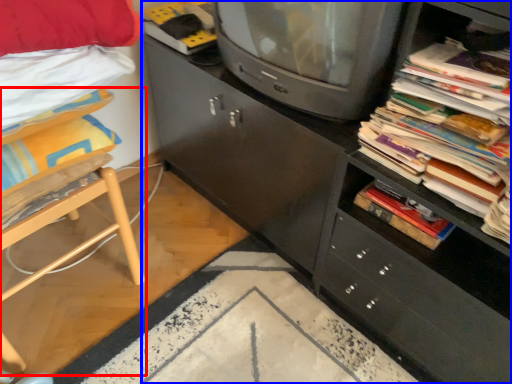
Question: Which object appears farthest to the camera in this image, furniture (highlighted by a red box) or cabinetry (highlighted by a blue box)?

Choices:
 (A) furniture
 (B) cabinetry

Answer: (A)